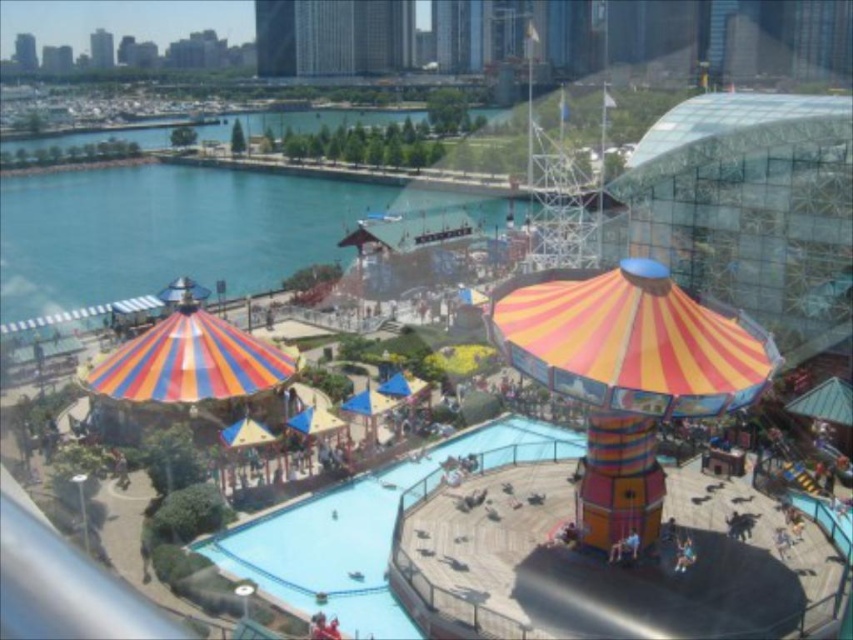
Question: Is blue wooden pool at center above blue water at center?

Choices:
 (A) yes
 (B) no

Answer: (B)

Question: Is blue wooden pool at center thinner than blue water at center?

Choices:
 (A) yes
 (B) no

Answer: (A)

Question: Is blue wooden pool at center further to camera compared to blue water at center?

Choices:
 (A) yes
 (B) no

Answer: (B)

Question: Among these objects, which one is nearest to the camera?

Choices:
 (A) blue wooden pool at center
 (B) blue water at center

Answer: (A)